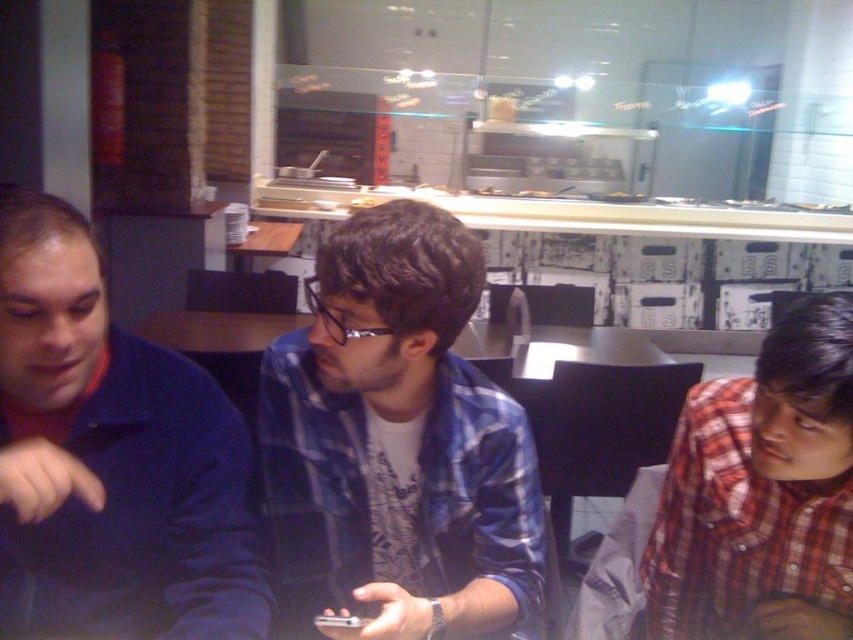
Question: Is blue plaid shirt at center to the left of plaid shirt at right from the viewer's perspective?

Choices:
 (A) yes
 (B) no

Answer: (A)

Question: Is blue plaid shirt at center behind plaid shirt at right?

Choices:
 (A) no
 (B) yes

Answer: (A)

Question: Is blue cotton shirt at left further to camera compared to plaid shirt at right?

Choices:
 (A) no
 (B) yes

Answer: (A)

Question: Which of the following is the closest to the observer?

Choices:
 (A) (131, 484)
 (B) (842, 467)
 (C) (418, 573)

Answer: (A)

Question: Which point is closer to the camera taking this photo?

Choices:
 (A) (213, 608)
 (B) (479, 296)

Answer: (A)

Question: Which object is closer to the camera taking this photo?

Choices:
 (A) blue cotton shirt at left
 (B) blue plaid shirt at center

Answer: (A)